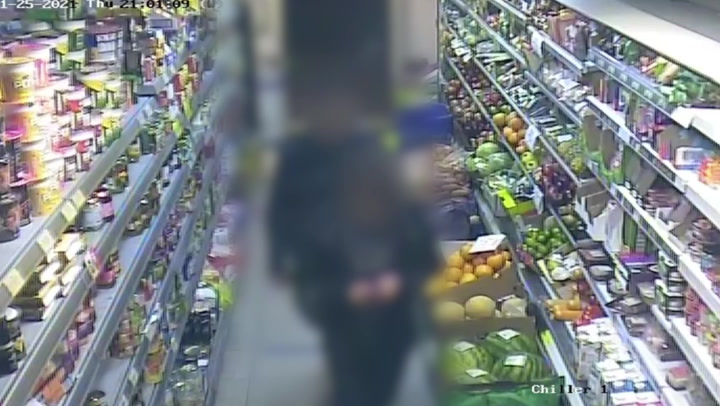
I want to click on doorway, so click(x=354, y=18).